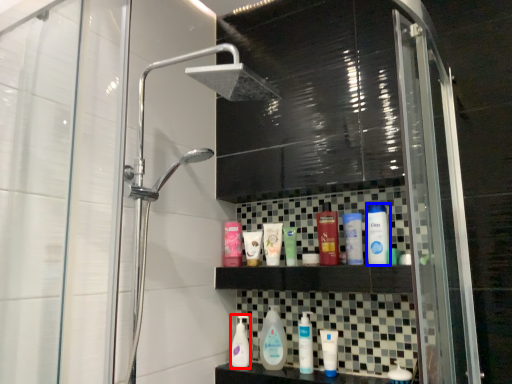
Question: Which of the following is the farthest to the observer, cleaning product (highlighted by a red box) or toiletry (highlighted by a blue box)?

Choices:
 (A) cleaning product
 (B) toiletry

Answer: (A)